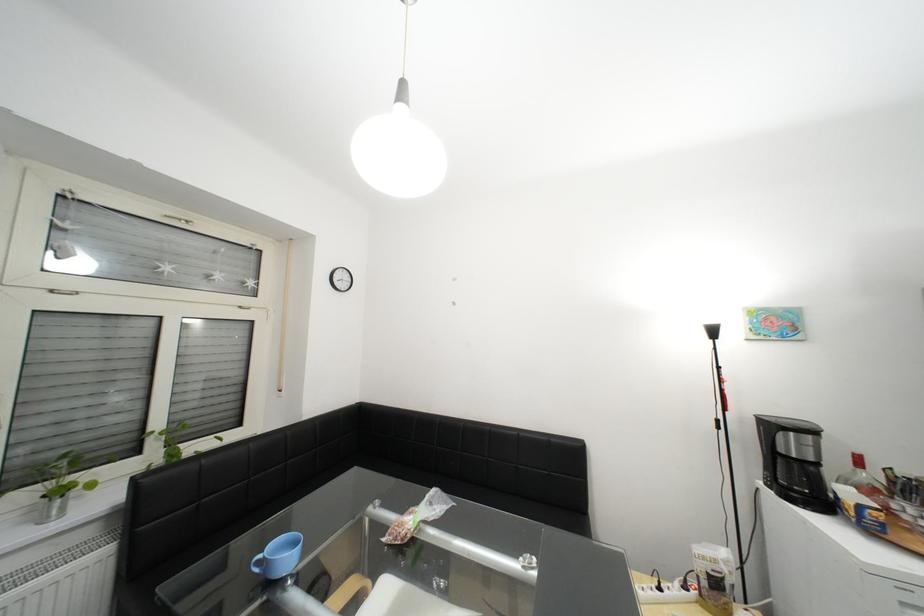
Where is `blue mug handle`? This screenshot has height=616, width=924. blue mug handle is located at coordinates (258, 562).